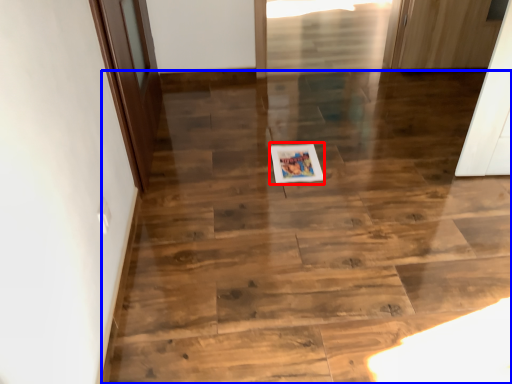
Question: Which of the following is the closest to the observer, postcard (highlighted by a red box) or stairwell (highlighted by a blue box)?

Choices:
 (A) postcard
 (B) stairwell

Answer: (B)